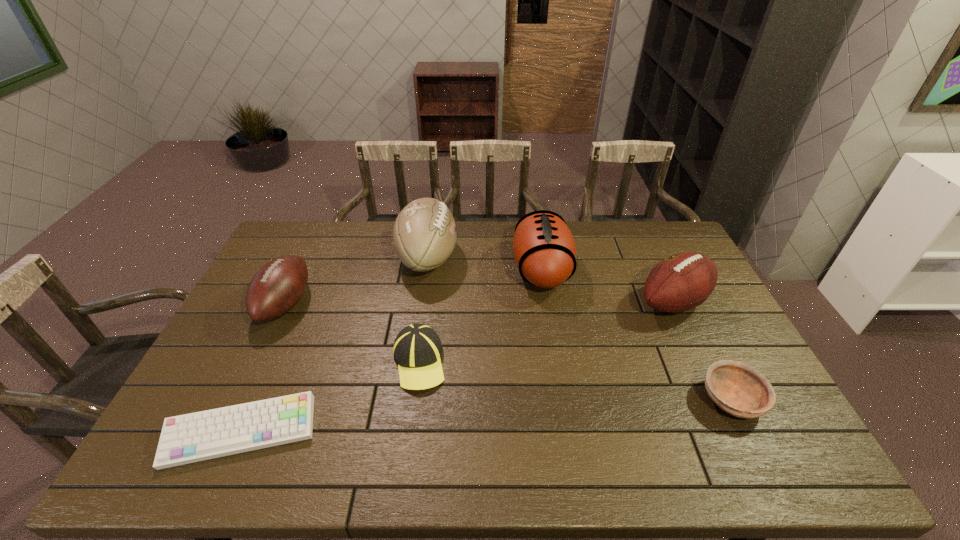
Find the location of a particular element. Image resolution: width=960 pixels, height=540 pixels. the third football (American) from right to left is located at coordinates (424, 235).

This screenshot has height=540, width=960. I want to click on the second football (American) from right to left, so click(x=544, y=249).

The image size is (960, 540). Find the location of `the rightmost football (American)`. the rightmost football (American) is located at coordinates (683, 281).

You are a GUI agent. You are given a task and a screenshot of the screen. Output one action in this format:
    pyautogui.click(x=<x>, y=<y>)
    Task: Click on the leftmost football (American)
    The image size is (960, 540).
    Given the screenshot: What is the action you would take?
    pyautogui.click(x=277, y=287)

The width and height of the screenshot is (960, 540). Find the location of `the fourth shortest object`. the fourth shortest object is located at coordinates (277, 287).

The width and height of the screenshot is (960, 540). I want to click on baseball cap, so click(x=417, y=349).

You are a GUI agent. You are given a task and a screenshot of the screen. Output one action in this format:
    pyautogui.click(x=<x>, y=<y>)
    Task: Click on the bowl
    This screenshot has height=540, width=960.
    Given the screenshot: What is the action you would take?
    [x=740, y=390]

You are a GUI agent. You are given a task and a screenshot of the screen. Output one action in this format:
    pyautogui.click(x=<x>, y=<y>)
    Task: Click on the shortest object
    The image size is (960, 540).
    Given the screenshot: What is the action you would take?
    pyautogui.click(x=194, y=437)

Locate an element on the screen. vacant space located 0.050m on the laces of the second football (American) from left to right is located at coordinates (471, 258).

This screenshot has width=960, height=540. Find the location of `free space located on the front of the third object from right to left`. free space located on the front of the third object from right to left is located at coordinates (564, 406).